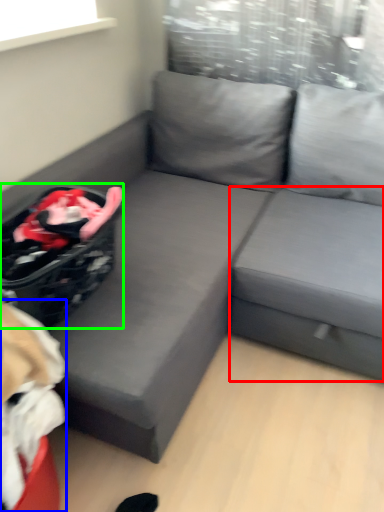
Question: Considering the real-world distances, which object is closest to table (highlighted by a red box)? bean bag chair (highlighted by a blue box) or laundry basket (highlighted by a green box).

Choices:
 (A) bean bag chair
 (B) laundry basket

Answer: (B)